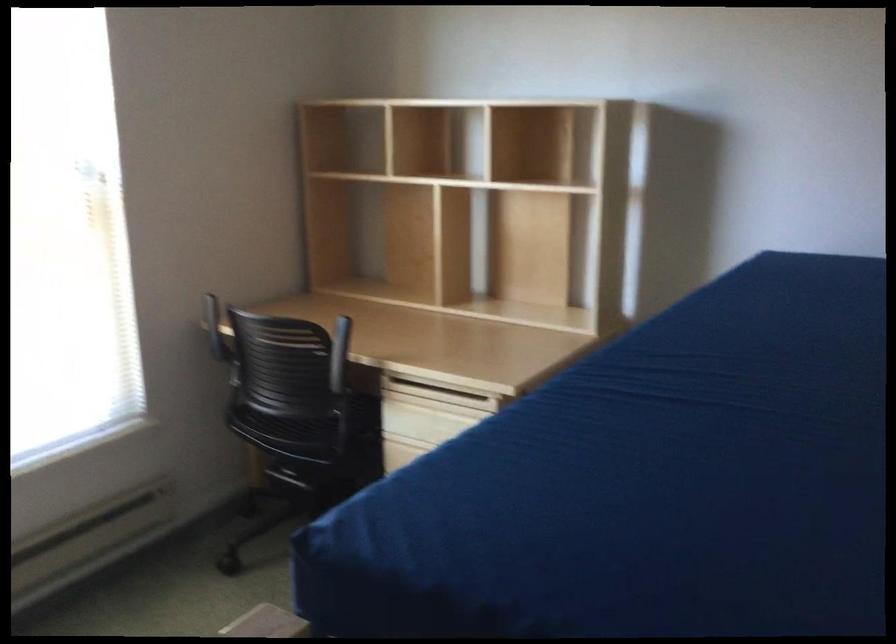
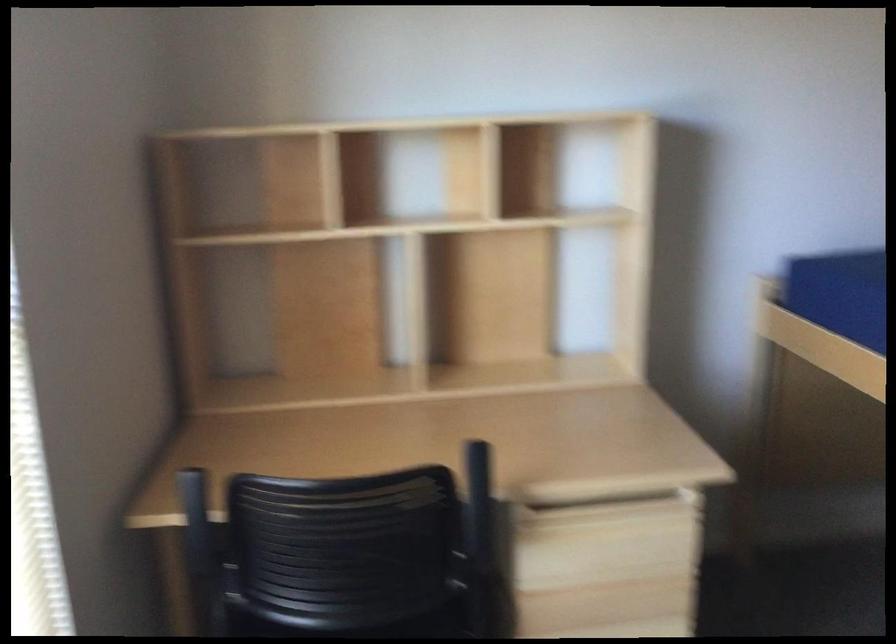
Find the pixel in the second image that matches point 444,404 in the first image.

(616, 520)